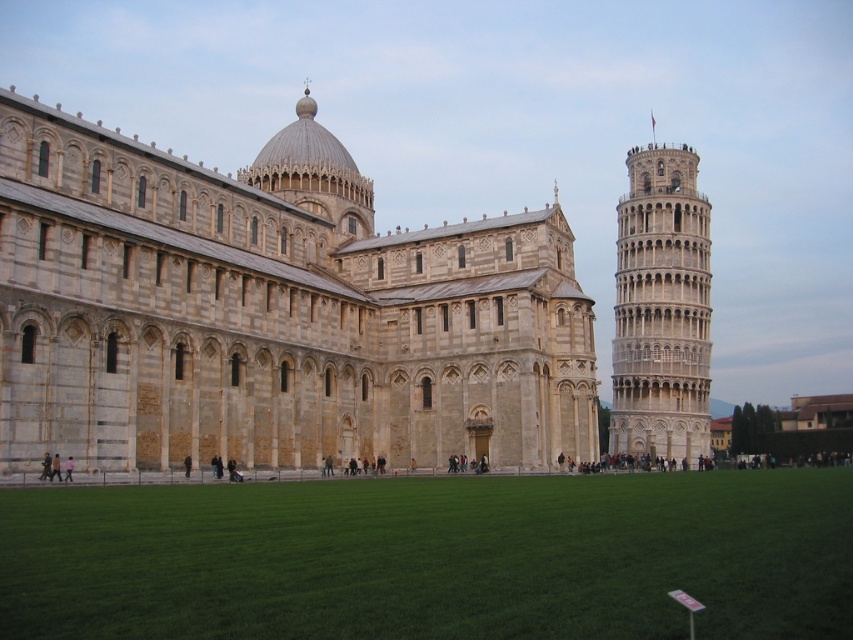
Does light beige stone cathedral at center appear on the left side of light beige stone tower at right?

Yes, light beige stone cathedral at center is to the left of light beige stone tower at right.

Is light beige stone cathedral at center to the right of light beige stone tower at right from the viewer's perspective?

Incorrect, light beige stone cathedral at center is not on the right side of light beige stone tower at right.

Find the location of a particular element. light beige stone cathedral at center is located at coordinates (271, 310).